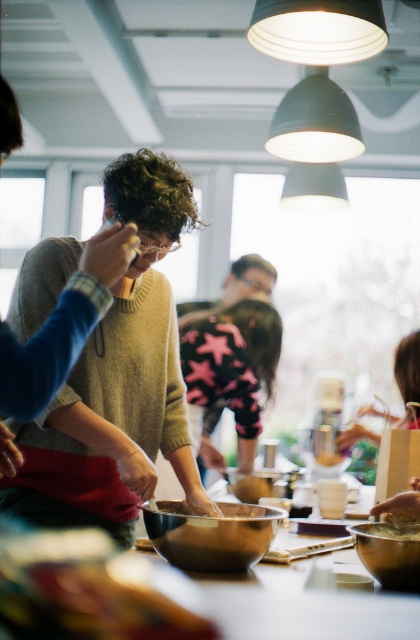
You are standing in the kitchen and want to move from the point at coordinates point (399, 593) to the point at coordinates point (409, 413). Can you walk directly between them without any obstacles?

Point (399, 593) is in front of point (409, 413), so there is an obstacle between them. Therefore, you cannot walk directly between them without any obstacles.

From the picture: You are a participant in the cooking class and need to access both the shiny metallic bowl at center and the metallic bowl at lower center. Which bowl would you need to move first to reach the one behind it?

The metallic bowl at lower center is behind the shiny metallic bowl at center, so you would need to move the shiny metallic bowl at center first to access the one behind it.